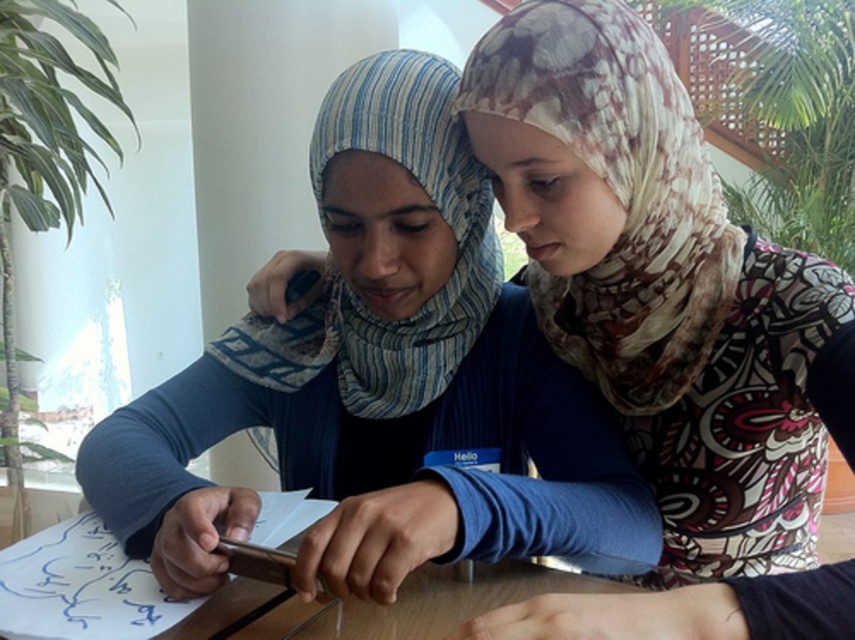
Question: Which point appears farthest from the camera in this image?

Choices:
 (A) (426, 157)
 (B) (479, 298)

Answer: (B)

Question: Is blue fabric shirt at center bigger than blue striped scarf at center?

Choices:
 (A) no
 (B) yes

Answer: (B)

Question: Can you confirm if printed silk scarf at upper right is positioned to the right of blue striped scarf at center?

Choices:
 (A) yes
 (B) no

Answer: (A)

Question: Which is farther from the printed silk scarf at upper right?

Choices:
 (A) blue striped scarf at center
 (B) blue fabric shirt at center

Answer: (B)

Question: Does blue fabric shirt at center lie in front of blue striped scarf at center?

Choices:
 (A) no
 (B) yes

Answer: (B)

Question: Which point is farther to the camera?

Choices:
 (A) printed silk scarf at upper right
 (B) blue striped scarf at center

Answer: (B)